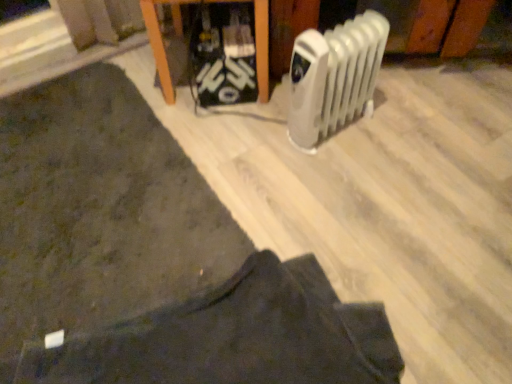
Question: Considering the relative positions of dark fabric pants at lower center and dark fabric mat at lower left in the image provided, is dark fabric pants at lower center to the left or to the right of dark fabric mat at lower left?

Choices:
 (A) left
 (B) right

Answer: (B)

Question: From their relative heights in the image, would you say dark fabric pants at lower center is taller or shorter than dark fabric mat at lower left?

Choices:
 (A) tall
 (B) short

Answer: (B)

Question: Which object is the closest to the dark fabric pants at lower center?

Choices:
 (A) white plastic radiator at right
 (B) dark fabric mat at lower left
 (C) wooden table at upper center

Answer: (B)

Question: Which object is the farthest from the white plastic radiator at right?

Choices:
 (A) dark fabric pants at lower center
 (B) wooden table at upper center
 (C) dark fabric mat at lower left

Answer: (A)